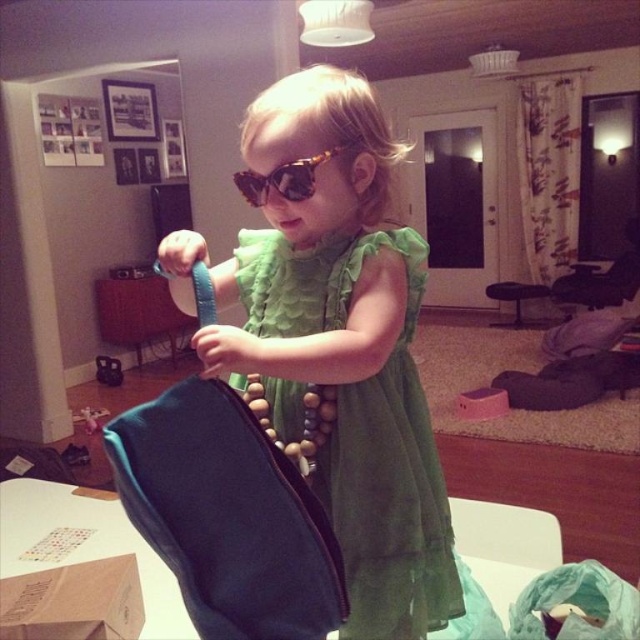
You are a photographer trying to capture a closeup shot of the tortoiseshell acetate sunglasses at center. Considering the distance between the camera and the sunglasses, can you get a clear closeup without moving the camera or the sunglasses?

The tortoiseshell acetate sunglasses at center is 33.81 inches away from camera. A typical camera lens can focus clearly at distances of 12 inches or closer. Since the sunglasses are farther away than that, you cannot get a clear closeup without moving the camera or the sunglasses.